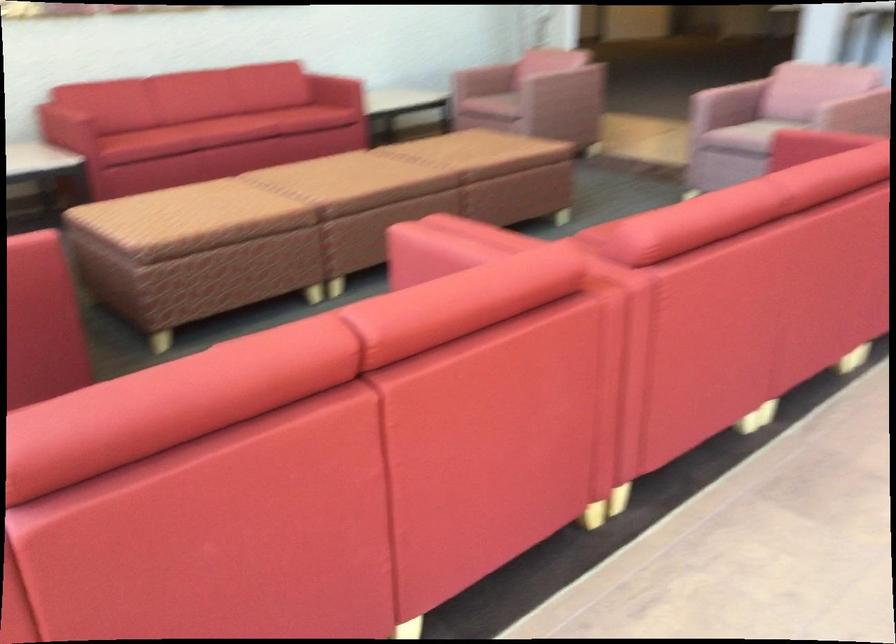
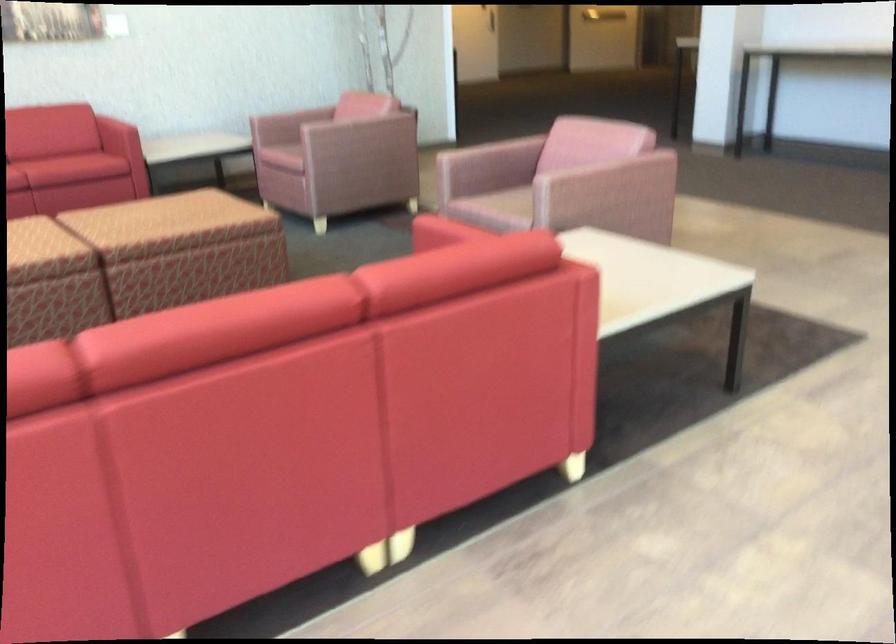
What movement of the cameraman would produce the second image?

A: The cameraman moved toward right, forward.